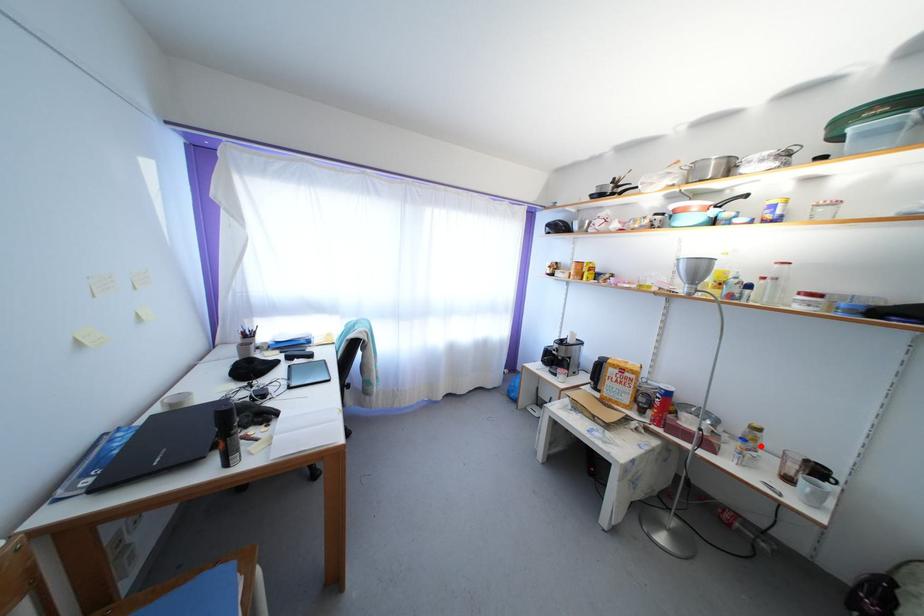
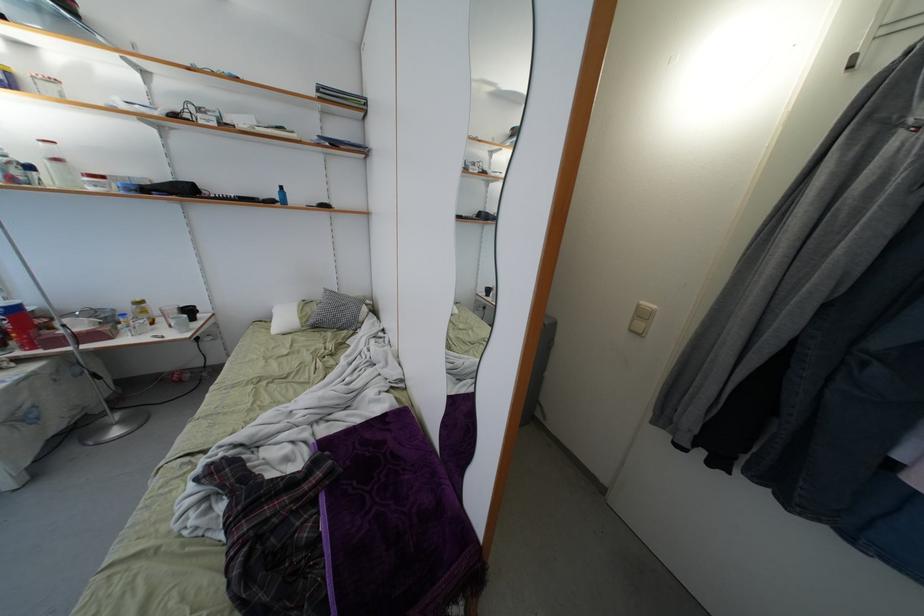
In the second image, find the point that corresponds to the highlighted location in the first image.

(149, 317)